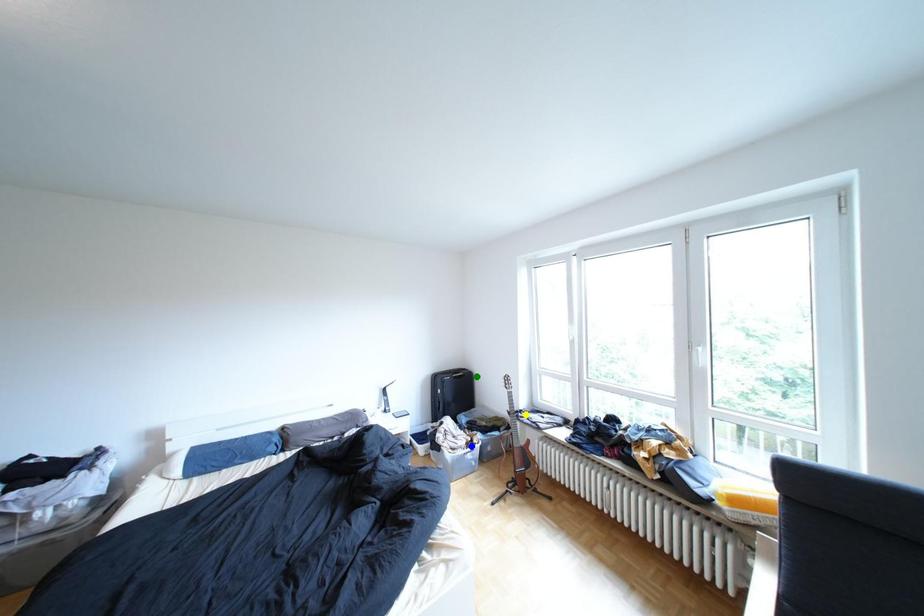
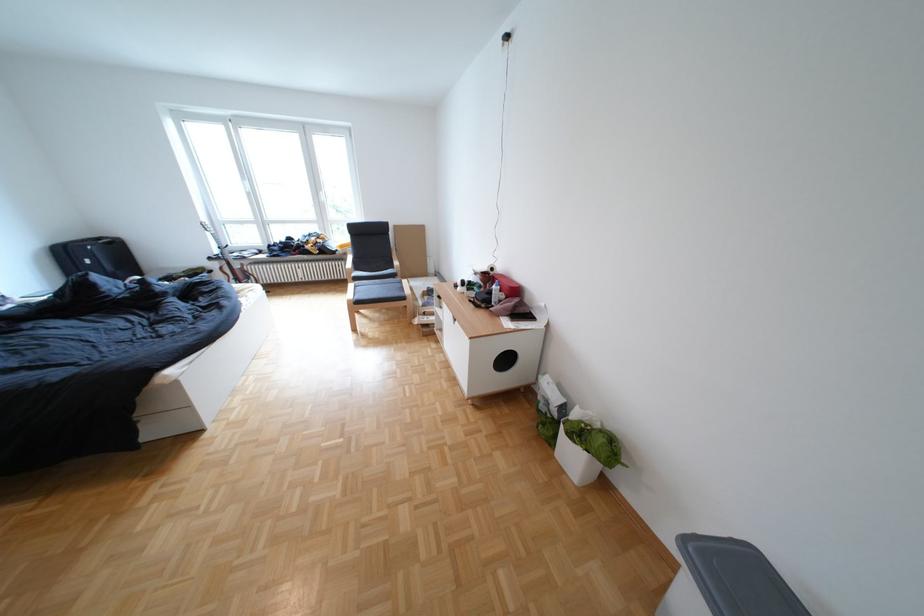
I am providing you with two images of the same scene from different viewpoints. Three points are marked in image1. Which point corresponds to a part or object that is occluded in image2?In image1, three points are marked. Which of them correspond to a part or object that is occluded in image2?Among the three points shown in image1, which one corresponds to a part or object that is no longer visible due to occlusion in image2?

Invisible in image2: blue point.